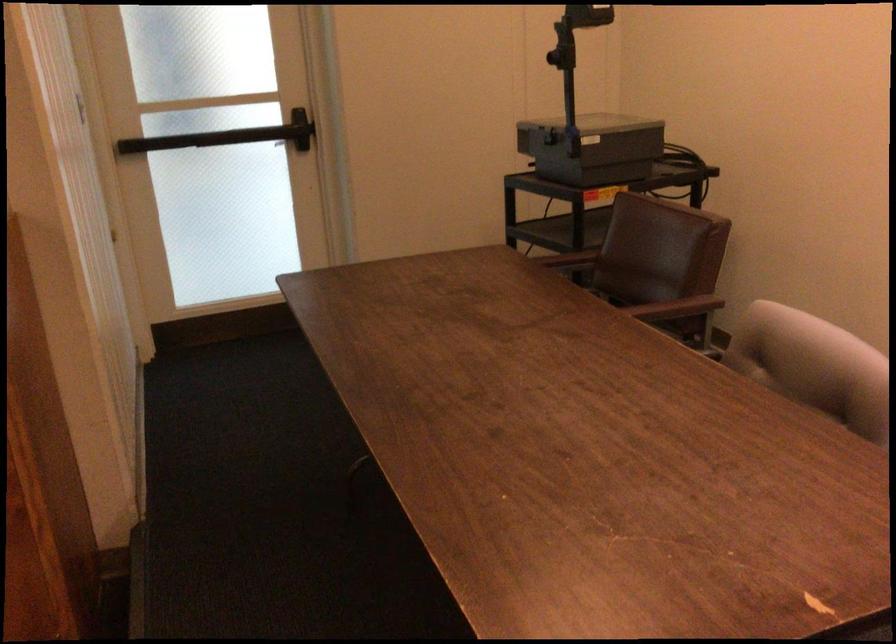
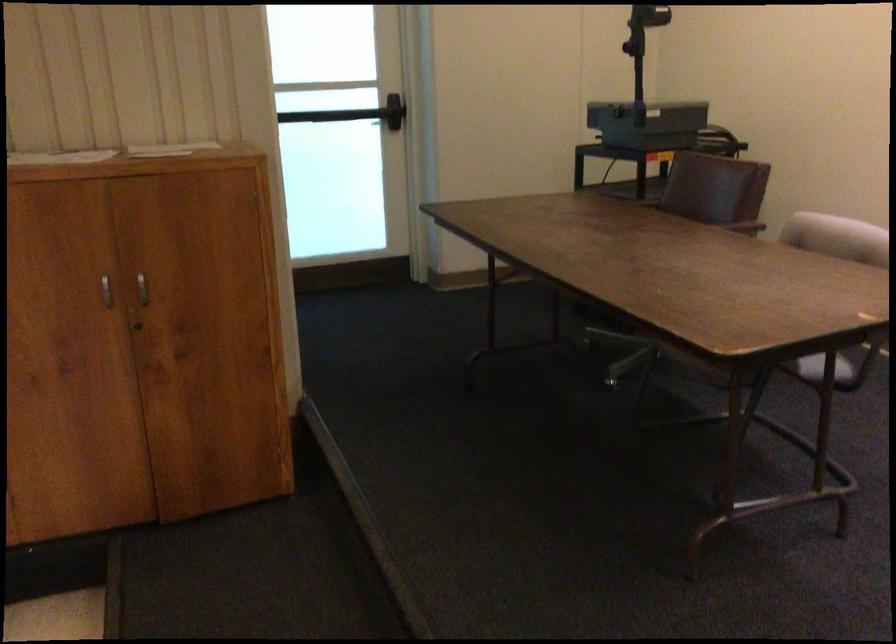
Where in the second image is the point corresponding to pixel 686 294 from the first image?

(739, 223)